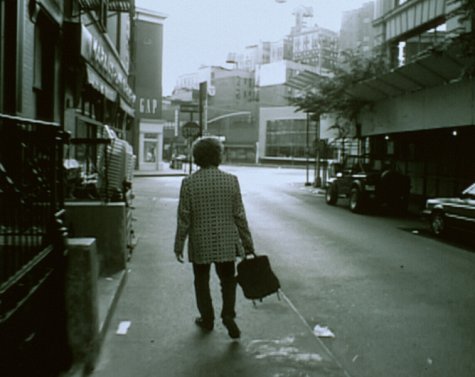
Locate an element on the screen. The image size is (475, 377). coat is located at coordinates (211, 216).